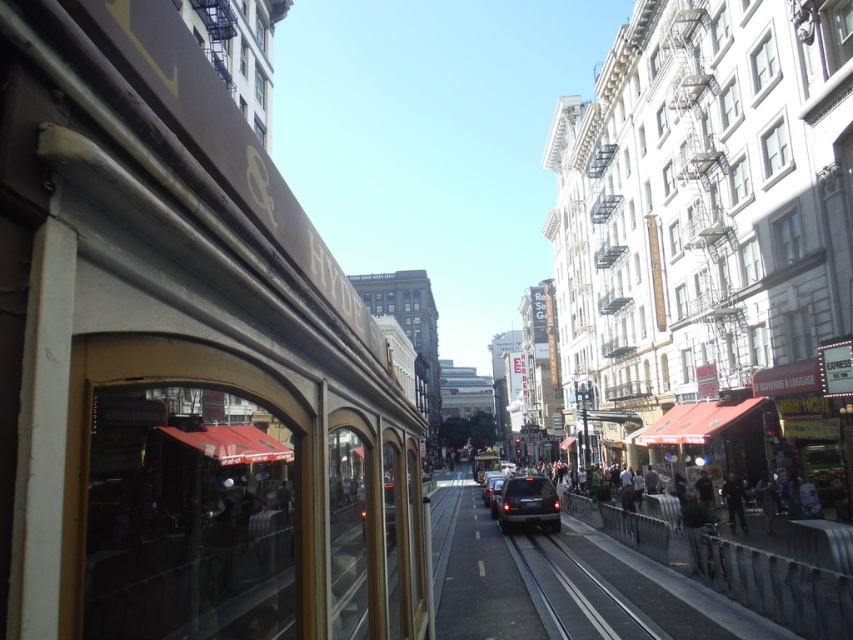
Question: Which object appears farthest from the camera in this image?

Choices:
 (A) shiny black suv at center
 (B) dark blue jeans at lower right
 (C) shiny black car at center
 (D) metallic gray train track at center

Answer: (C)

Question: Does shiny black suv at center have a lesser width compared to dark gray jacket at lower right?

Choices:
 (A) yes
 (B) no

Answer: (B)

Question: Which of the following is the farthest from the observer?

Choices:
 (A) gold polished metal train at left
 (B) shiny black car at center

Answer: (B)

Question: Among these points, which one is farthest from the camera?

Choices:
 (A) (485, 504)
 (B) (738, 480)

Answer: (A)

Question: Is gold polished metal train at left in front of metallic gray train track at center?

Choices:
 (A) yes
 (B) no

Answer: (A)

Question: Where is shiny black suv at center located in relation to dark gray jacket at lower right in the image?

Choices:
 (A) right
 (B) left

Answer: (B)